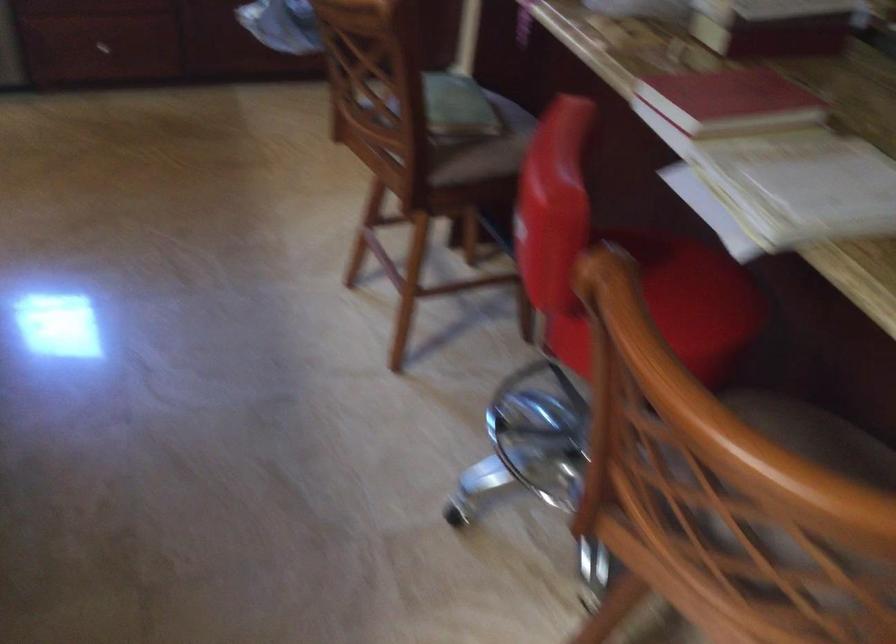
What do you see at coordinates (669, 279) in the screenshot? I see `a red chair sitting surface` at bounding box center [669, 279].